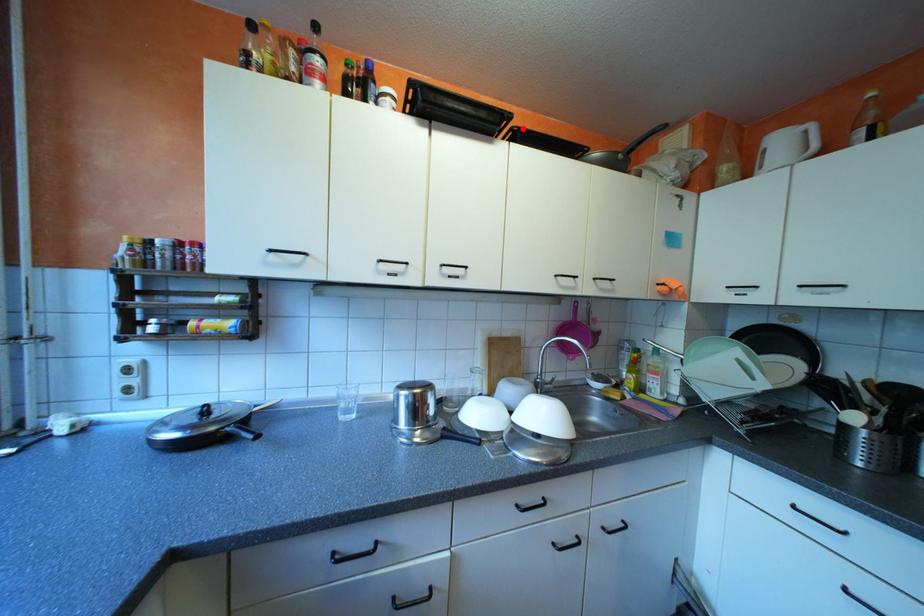
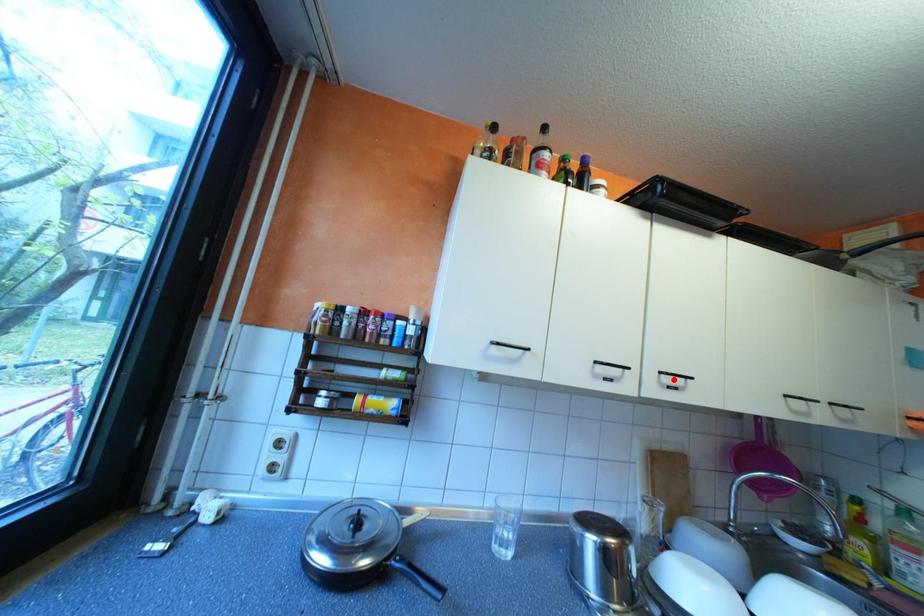
I am providing you with two images of the same scene from different viewpoints. A red point is marked on the first image and another point is marked on the second image. Are the points marked in image1 and image2 representing the same 3D position?

No